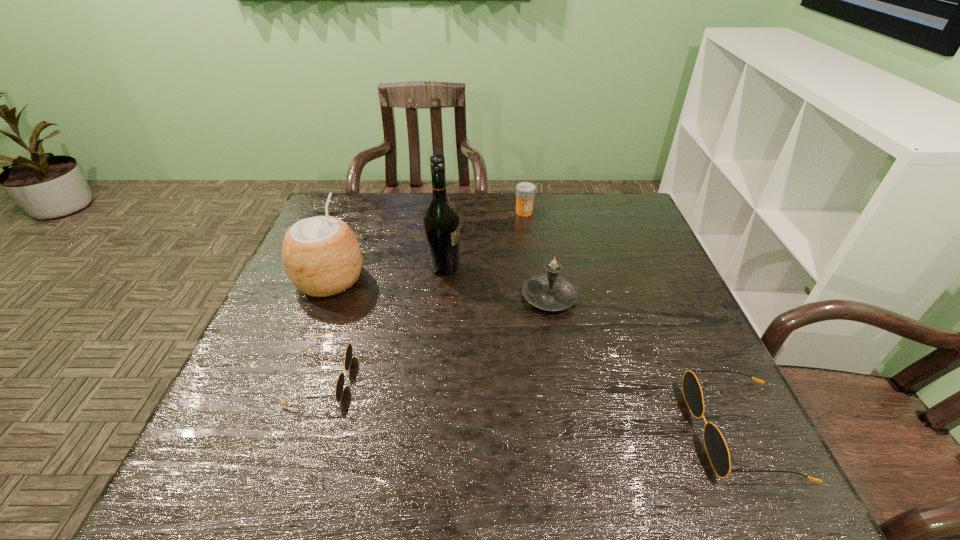
Locate an element on the screen. The width and height of the screenshot is (960, 540). the shorter sunglasses is located at coordinates (340, 382).

The image size is (960, 540). What are the coordinates of `the left sunglasses` in the screenshot? It's located at (340, 382).

Find the location of a particular element. the rightmost object is located at coordinates (717, 450).

You are a GUI agent. You are given a task and a screenshot of the screen. Output one action in this format:
    pyautogui.click(x=<x>, y=<y>)
    Task: Click on the right sunglasses
    The width and height of the screenshot is (960, 540).
    Given the screenshot: What is the action you would take?
    pyautogui.click(x=717, y=450)

This screenshot has width=960, height=540. Find the location of `the third shortest object`. the third shortest object is located at coordinates (525, 191).

Identify the location of medicine. This screenshot has height=540, width=960. (525, 191).

At what (x,y) coordinates should I click in order to perform the action: click on the fourth object from right to left. Please return your answer as a coordinate pair (x, y). This screenshot has width=960, height=540. Looking at the image, I should click on (441, 223).

What are the coordinates of `wine bottle` in the screenshot? It's located at (441, 223).

I want to click on candle, so click(x=551, y=292).

Find the location of a particular element. coconut is located at coordinates (321, 254).